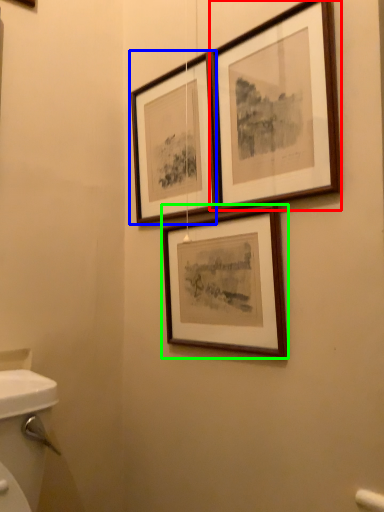
Question: Considering the real-world distances, which object is closest to picture frame (highlighted by a red box)? picture frame (highlighted by a blue box) or picture frame (highlighted by a green box).

Choices:
 (A) picture frame
 (B) picture frame

Answer: (A)